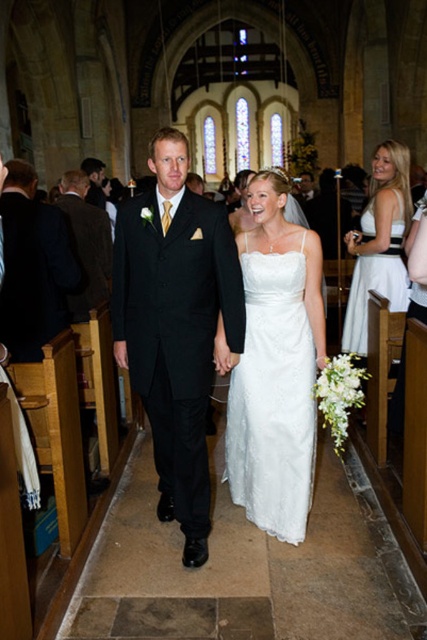
Who is shorter, white lace dress at center or brown wool suit at left?

Standing shorter between the two is brown wool suit at left.

Is point (271, 440) positioned in front of point (105, 212)?

Yes, point (271, 440) is in front of point (105, 212).

At what (x,y) coordinates should I click in order to perform the action: click on white lace dress at center. Please return your answer as a coordinate pair (x, y). This screenshot has height=640, width=427. Looking at the image, I should click on (274, 394).

Looking at this image, does white lace dress at center appear over shiny black suit at center?

Incorrect, white lace dress at center is not positioned above shiny black suit at center.

You are a GUI agent. You are given a task and a screenshot of the screen. Output one action in this format:
    pyautogui.click(x=<x>, y=<y>)
    Task: Click on the white lace dress at center
    
    Given the screenshot: What is the action you would take?
    pyautogui.click(x=274, y=394)

Identify the location of white lace dress at center. (274, 394).

Does shiny black suit at center have a larger size compared to brown wool suit at left?

Indeed, shiny black suit at center has a larger size compared to brown wool suit at left.

Can you confirm if shiny black suit at center is positioned to the left of brown wool suit at left?

Correct, you'll find shiny black suit at center to the left of brown wool suit at left.

Locate an element on the screen. Image resolution: width=427 pixels, height=640 pixels. shiny black suit at center is located at coordinates (34, 266).

Image resolution: width=427 pixels, height=640 pixels. I want to click on shiny black suit at center, so click(34, 266).